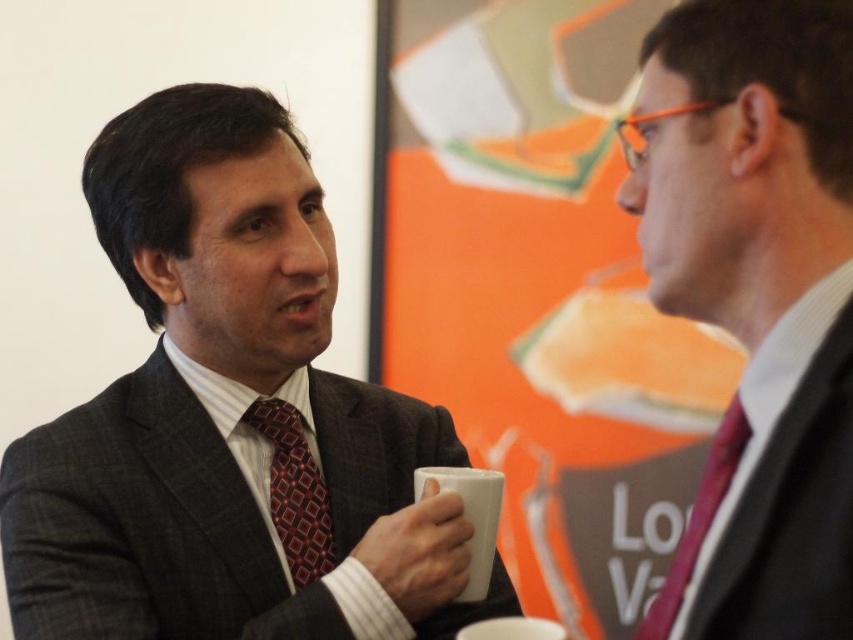
You are standing at the camera position and want to touch the point at coordinates point (x=811, y=179) in the image. Can you reach it without moving your body?

The point (x=811, y=179) is 23.70 inches away from the camera, so you can reach it without moving your body if your arm can extend that far.

Looking at this image, based on the scene description, what are the coordinates of the matte black suit at right?

The coordinates of the matte black suit at right are at point (757,300).

Looking at this image, you are a photographer setting up a shoot in this scene. You need to position a spotlight so that it illuminates the matte black suit at left and the white matte mug at center without casting shadows on the background. Based on their positions, where should you place the spotlight relative to the two objects?

The spotlight should be placed above the matte black suit at left and the white matte mug at center to avoid casting shadows on the background since the matte black suit at left is positioned above the white matte mug at center.